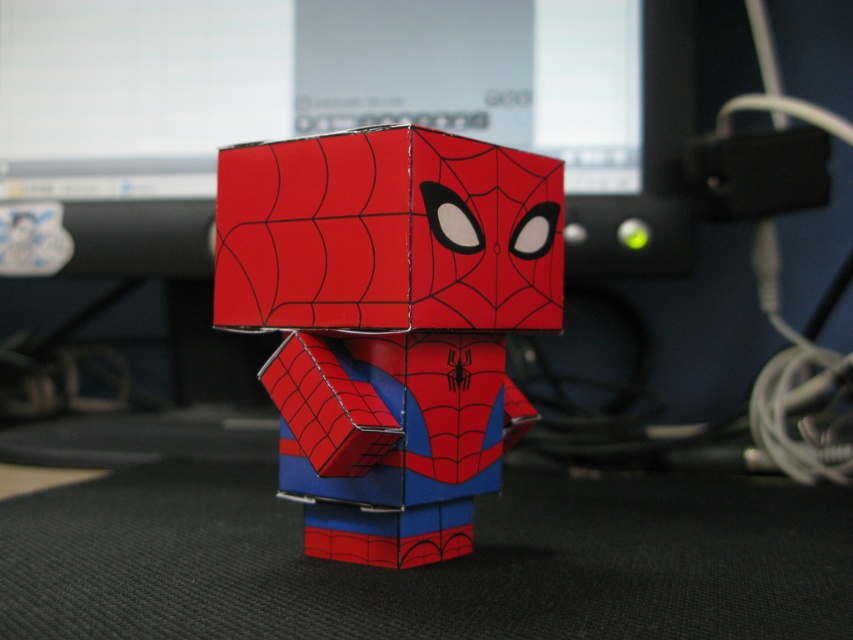
Question: Which point appears closest to the camera in this image?

Choices:
 (A) (505, 282)
 (B) (321, 99)

Answer: (A)

Question: Is matte black monitor at center behind cardboard spider-man figure at center?

Choices:
 (A) yes
 (B) no

Answer: (A)

Question: Observing the image, what is the correct spatial positioning of matte black monitor at center in reference to cardboard spider-man figure at center?

Choices:
 (A) above
 (B) below

Answer: (A)

Question: Is matte black monitor at center thinner than cardboard spider-man figure at center?

Choices:
 (A) yes
 (B) no

Answer: (B)

Question: Which object appears farthest from the camera in this image?

Choices:
 (A) matte black monitor at center
 (B) cardboard spider-man figure at center

Answer: (A)